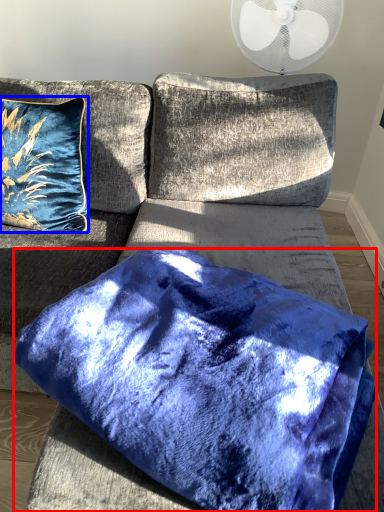
Question: Which of the following is the farthest to the observer, pillow (highlighted by a red box) or pillow (highlighted by a blue box)?

Choices:
 (A) pillow
 (B) pillow

Answer: (B)